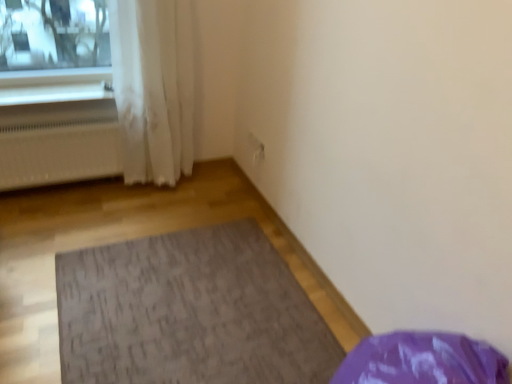
You are a GUI agent. You are given a task and a screenshot of the screen. Output one action in this format:
    pyautogui.click(x=<x>, y=<y>)
    Task: Click on the free space above white matte radiator at left (from a real-world perspective)
    
    Given the screenshot: What is the action you would take?
    pyautogui.click(x=45, y=118)